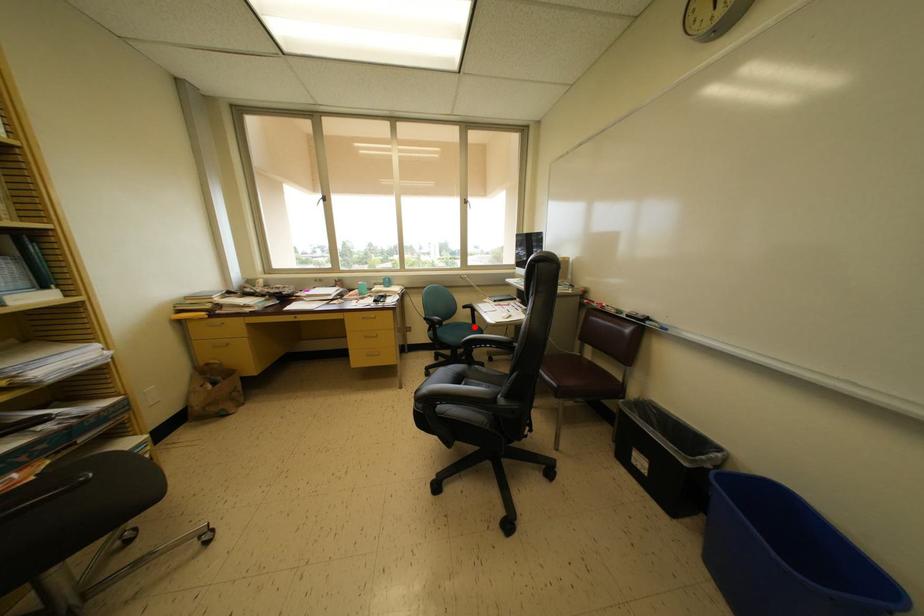
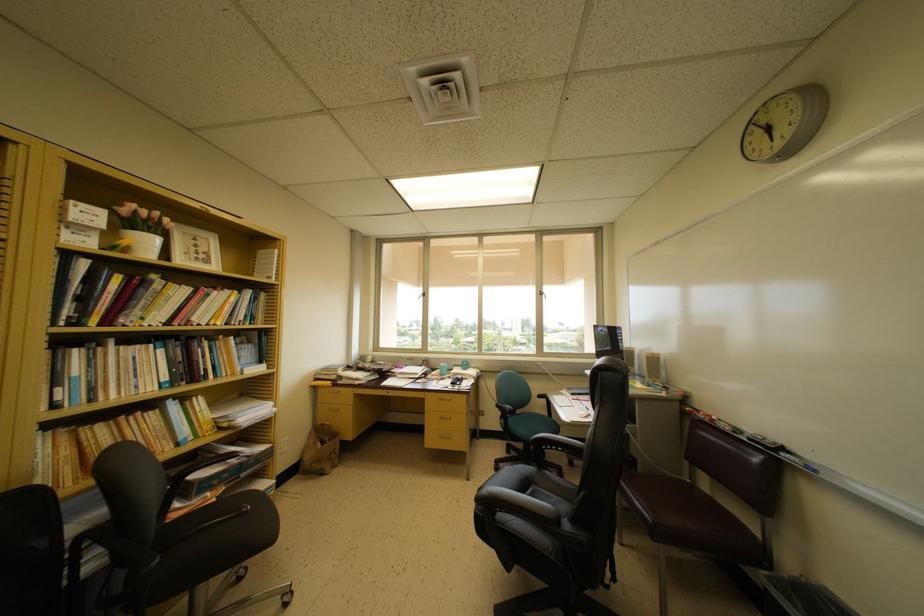
Locate, in the second image, the point that corresponds to the highlighted location in the first image.

(551, 419)